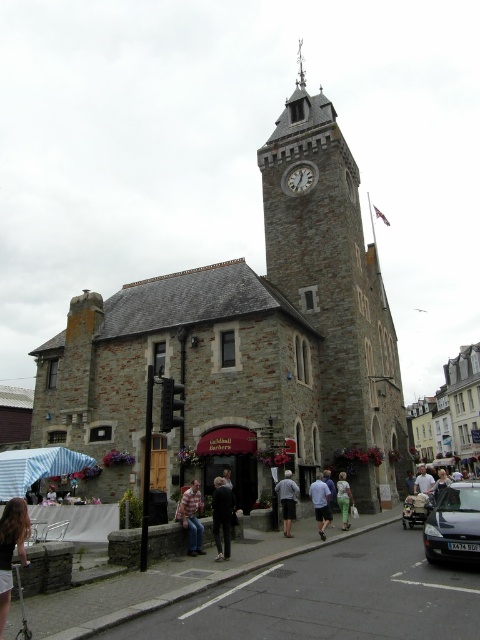
Can you confirm if blonde hair at lower left is taller than light blue shirt at center?

Correct, blonde hair at lower left is much taller as light blue shirt at center.

The height and width of the screenshot is (640, 480). I want to click on blonde hair at lower left, so click(11, 548).

Where is `blonde hair at lower left`? blonde hair at lower left is located at coordinates (11, 548).

Who is higher up, striped shirt at center or white stone clock at center?

white stone clock at center is above.

Does striped shirt at center have a smaller size compared to white stone clock at center?

No.

This screenshot has width=480, height=640. In order to click on striped shirt at center in this screenshot , I will do `click(192, 516)`.

Is striped shirt at center closer to camera compared to light blue denim shorts at center?

Yes, it is.

The height and width of the screenshot is (640, 480). What are the coordinates of `striped shirt at center` in the screenshot? It's located at (192, 516).

The image size is (480, 640). I want to click on striped shirt at center, so click(x=192, y=516).